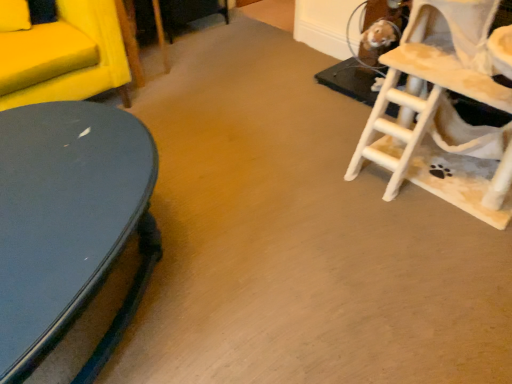
Question: Should I look upward or downward to see white wooden ladder at right?

Choices:
 (A) down
 (B) up

Answer: (B)

Question: Is glossy dark blue table at left touching white wooden ladder at right?

Choices:
 (A) yes
 (B) no

Answer: (B)

Question: Is glossy dark blue table at left positioned beyond the bounds of white wooden ladder at right?

Choices:
 (A) yes
 (B) no

Answer: (A)

Question: Is glossy dark blue table at left smaller than white wooden ladder at right?

Choices:
 (A) no
 (B) yes

Answer: (B)

Question: Does glossy dark blue table at left have a larger size compared to white wooden ladder at right?

Choices:
 (A) yes
 (B) no

Answer: (B)

Question: From the image's perspective, is glossy dark blue table at left beneath white wooden ladder at right?

Choices:
 (A) no
 (B) yes

Answer: (B)

Question: Is the depth of glossy dark blue table at left greater than that of white wooden ladder at right?

Choices:
 (A) no
 (B) yes

Answer: (A)

Question: Considering the relative sizes of white wooden ladder at right and glossy dark blue table at left in the image provided, is white wooden ladder at right wider than glossy dark blue table at left?

Choices:
 (A) yes
 (B) no

Answer: (B)

Question: Is white wooden ladder at right at the right side of glossy dark blue table at left?

Choices:
 (A) yes
 (B) no

Answer: (A)

Question: Is white wooden ladder at right next to glossy dark blue table at left?

Choices:
 (A) no
 (B) yes

Answer: (A)

Question: From a real-world perspective, does white wooden ladder at right stand above glossy dark blue table at left?

Choices:
 (A) yes
 (B) no

Answer: (A)

Question: Is white wooden ladder at right shorter than glossy dark blue table at left?

Choices:
 (A) yes
 (B) no

Answer: (B)

Question: Does white wooden ladder at right have a larger size compared to glossy dark blue table at left?

Choices:
 (A) no
 (B) yes

Answer: (B)

Question: Would you say white wooden ladder at right is inside or outside glossy dark blue table at left?

Choices:
 (A) inside
 (B) outside

Answer: (B)